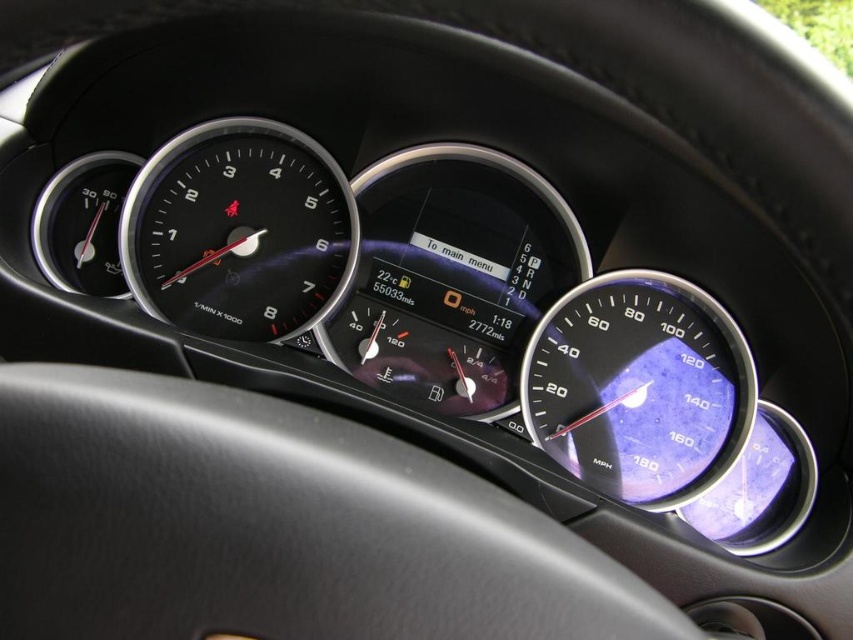
Question: In this image, where is transparent plastic speedometer at right located relative to black glass speedometer at center?

Choices:
 (A) right
 (B) left

Answer: (A)

Question: Is black leather steering wheel at center to the left of black glass speedometer at center from the viewer's perspective?

Choices:
 (A) yes
 (B) no

Answer: (B)

Question: Which of these objects is positioned closest to the black glass speedometer at center?

Choices:
 (A) transparent plastic speedometer at right
 (B) black leather steering wheel at center

Answer: (A)

Question: Does transparent plastic speedometer at right have a larger size compared to black glass speedometer at center?

Choices:
 (A) yes
 (B) no

Answer: (B)

Question: Which of the following is the farthest from the observer?

Choices:
 (A) (698, 371)
 (B) (310, 268)

Answer: (B)

Question: Which object is closer to the camera taking this photo?

Choices:
 (A) transparent plastic speedometer at right
 (B) black leather steering wheel at center
 (C) black glass speedometer at center

Answer: (B)